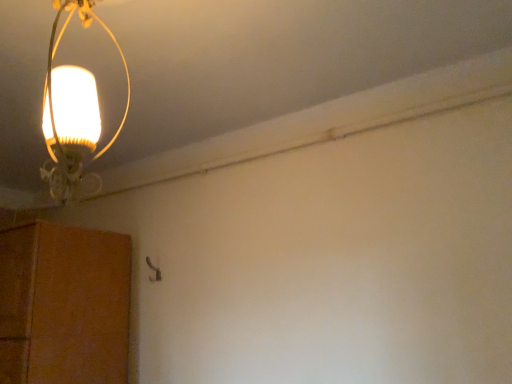
Question: Considering the relative positions of brown textured cabinet at lower left and matte glass lamp at upper left in the image provided, is brown textured cabinet at lower left to the left or to the right of matte glass lamp at upper left?

Choices:
 (A) right
 (B) left

Answer: (B)

Question: Considering the positions of brown textured cabinet at lower left and matte glass lamp at upper left in the image, is brown textured cabinet at lower left taller or shorter than matte glass lamp at upper left?

Choices:
 (A) tall
 (B) short

Answer: (A)

Question: From a real-world perspective, is brown textured cabinet at lower left physically located above or below matte glass lamp at upper left?

Choices:
 (A) below
 (B) above

Answer: (A)

Question: Choose the correct answer: Is matte glass lamp at upper left inside brown textured cabinet at lower left or outside it?

Choices:
 (A) inside
 (B) outside

Answer: (B)

Question: Would you say matte glass lamp at upper left is to the left or to the right of brown textured cabinet at lower left in the picture?

Choices:
 (A) left
 (B) right

Answer: (B)

Question: Is matte glass lamp at upper left wider or thinner than brown textured cabinet at lower left?

Choices:
 (A) thin
 (B) wide

Answer: (A)

Question: From the image's perspective, relative to brown textured cabinet at lower left, is matte glass lamp at upper left above or below?

Choices:
 (A) above
 (B) below

Answer: (A)